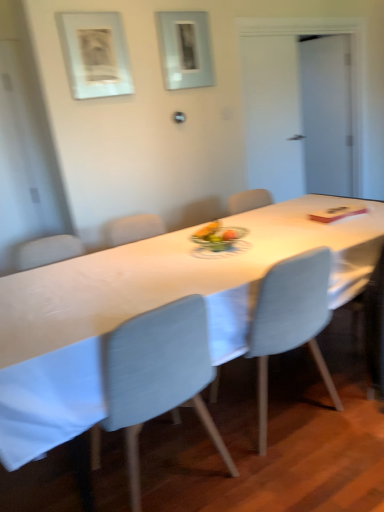
Question: Is white glossy table at center turned away from metallic gray picture frame at upper center, which is counted as the second picture frame, starting from the front?

Choices:
 (A) yes
 (B) no

Answer: (B)

Question: Is white glossy table at center shorter than metallic gray picture frame at upper center, which is counted as the second picture frame, starting from the front?

Choices:
 (A) no
 (B) yes

Answer: (B)

Question: Is white glossy table at center not close to metallic gray picture frame at upper center, positioned as the 1th picture frame in right-to-left order?

Choices:
 (A) no
 (B) yes

Answer: (B)

Question: From a real-world perspective, is white glossy table at center located higher than metallic gray picture frame at upper center, marked as the 2th picture frame in a left-to-right arrangement?

Choices:
 (A) no
 (B) yes

Answer: (A)

Question: Is white glossy table at center oriented towards metallic gray picture frame at upper center, positioned as the 1th picture frame in right-to-left order?

Choices:
 (A) no
 (B) yes

Answer: (A)

Question: Based on their positions, is metallic gray picture frame at upper center, marked as the 2th picture frame in a left-to-right arrangement, located to the left or right of light blue fabric chair at center, the 2th chair in the left-to-right sequence?

Choices:
 (A) left
 (B) right

Answer: (A)

Question: In terms of width, does metallic gray picture frame at upper center, marked as the 2th picture frame in a left-to-right arrangement, look wider or thinner when compared to light blue fabric chair at center, placed as the first chair when sorted from right to left?

Choices:
 (A) wide
 (B) thin

Answer: (B)

Question: From a real-world perspective, relative to light blue fabric chair at center, placed as the first chair when sorted from right to left, is metallic gray picture frame at upper center, marked as the 2th picture frame in a left-to-right arrangement, vertically above or below?

Choices:
 (A) below
 (B) above

Answer: (B)

Question: Is metallic gray picture frame at upper center, which is counted as the second picture frame, starting from the front, taller or shorter than light blue fabric chair at center, the 2th chair in the left-to-right sequence?

Choices:
 (A) short
 (B) tall

Answer: (A)

Question: From a real-world perspective, is light blue fabric chair at center, the 2th chair in the left-to-right sequence, positioned above or below metallic gray picture frame at upper center, positioned as the 1th picture frame in right-to-left order?

Choices:
 (A) above
 (B) below

Answer: (B)

Question: Is light blue fabric chair at center, the 2th chair in the left-to-right sequence, in front of or behind metallic gray picture frame at upper center, marked as the 2th picture frame in a left-to-right arrangement, in the image?

Choices:
 (A) front
 (B) behind

Answer: (A)

Question: From their relative heights in the image, would you say light blue fabric chair at center, the 2th chair in the left-to-right sequence, is taller or shorter than metallic gray picture frame at upper center, positioned as the 1th picture frame in right-to-left order?

Choices:
 (A) tall
 (B) short

Answer: (A)

Question: Is light blue fabric chair at center, placed as the first chair when sorted from right to left, inside the boundaries of metallic gray picture frame at upper center, marked as the 2th picture frame in a left-to-right arrangement, or outside?

Choices:
 (A) inside
 (B) outside

Answer: (B)

Question: From the image's perspective, relative to transparent glass door at upper right, is light blue fabric chair at center, the 2th chair in the left-to-right sequence, above or below?

Choices:
 (A) below
 (B) above

Answer: (A)

Question: In terms of width, does light blue fabric chair at center, the 2th chair in the left-to-right sequence, look wider or thinner when compared to transparent glass door at upper right?

Choices:
 (A) wide
 (B) thin

Answer: (A)